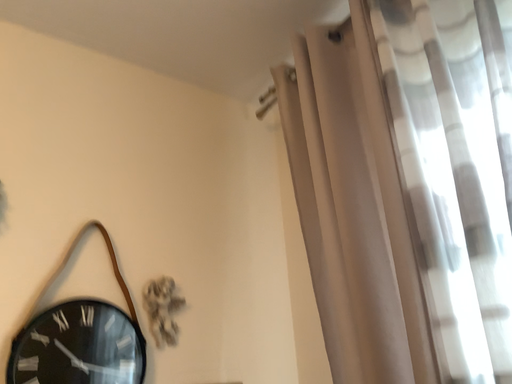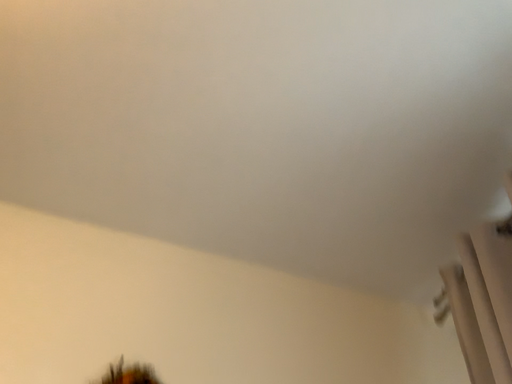
Question: Which way did the camera rotate in the video?

Choices:
 (A) rotated right
 (B) rotated left

Answer: (B)